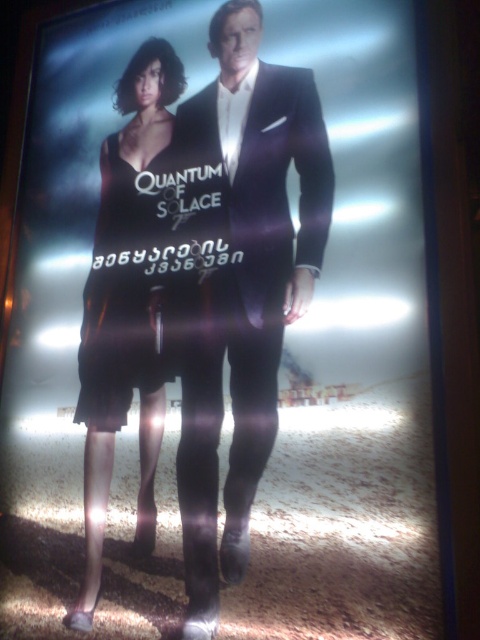
Question: Considering the relative positions of shiny black suit at center and black satin dress at center in the image provided, where is shiny black suit at center located with respect to black satin dress at center?

Choices:
 (A) left
 (B) right

Answer: (B)

Question: Which object appears closest to the camera in this image?

Choices:
 (A) satin black dress at left
 (B) black satin dress at center
 (C) shiny black suit at center

Answer: (C)

Question: Among these objects, which one is farthest from the camera?

Choices:
 (A) shiny black suit at center
 (B) satin black dress at left

Answer: (B)

Question: Which point is closer to the camera taking this photo?

Choices:
 (A) (90, 284)
 (B) (269, 449)
 (C) (124, 346)

Answer: (B)

Question: Considering the relative positions of shiny black suit at center and black satin dress at center in the image provided, where is shiny black suit at center located with respect to black satin dress at center?

Choices:
 (A) right
 (B) left

Answer: (A)

Question: Is shiny black suit at center bigger than satin black dress at left?

Choices:
 (A) no
 (B) yes

Answer: (B)